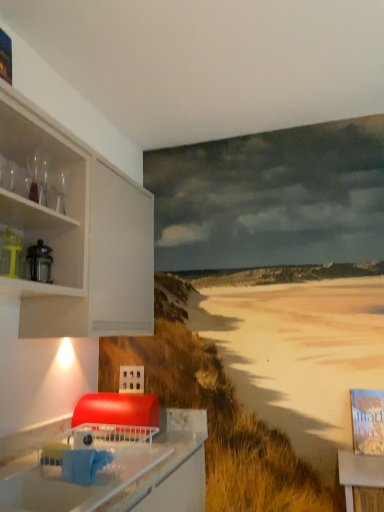
Question: From a real-world perspective, is matte yellow juicer at left positioned above or below white glossy countertop at lower left?

Choices:
 (A) below
 (B) above

Answer: (B)

Question: In terms of size, does matte yellow juicer at left appear bigger or smaller than white glossy countertop at lower left?

Choices:
 (A) big
 (B) small

Answer: (B)

Question: Is matte yellow juicer at left to the left or to the right of white glossy countertop at lower left in the image?

Choices:
 (A) right
 (B) left

Answer: (B)

Question: Relative to matte yellow juicer at left, is white glossy countertop at lower left in front or behind?

Choices:
 (A) behind
 (B) front

Answer: (B)

Question: From a real-world perspective, relative to matte yellow juicer at left, is white glossy countertop at lower left vertically above or below?

Choices:
 (A) below
 (B) above

Answer: (A)

Question: Is white glossy countertop at lower left inside the boundaries of matte yellow juicer at left, or outside?

Choices:
 (A) outside
 (B) inside

Answer: (A)

Question: Would you say white glossy countertop at lower left is to the left or to the right of matte yellow juicer at left in the picture?

Choices:
 (A) right
 (B) left

Answer: (A)